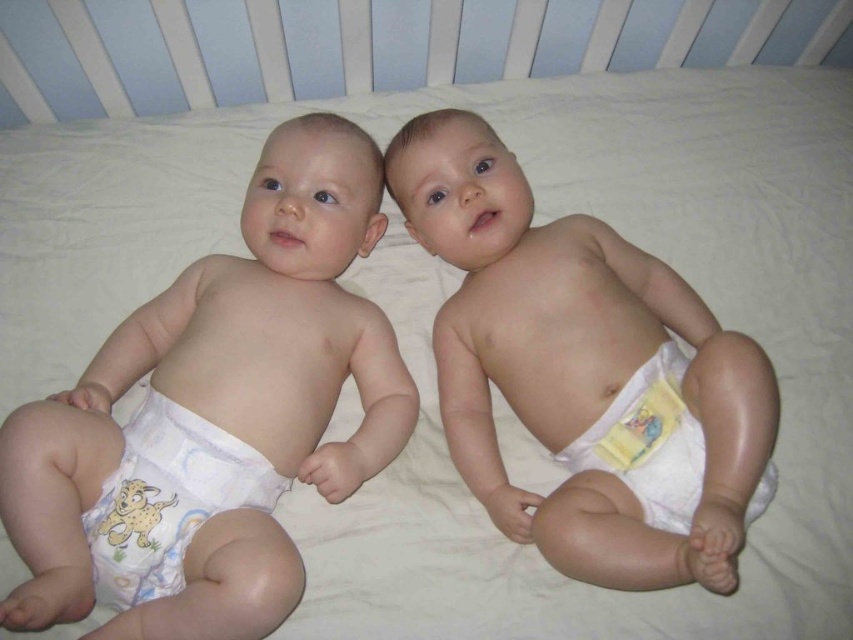
Question: Which of the following is the closest to the observer?

Choices:
 (A) (372, 321)
 (B) (194, 460)
 (C) (630, 460)

Answer: (B)

Question: Is white cloth diaper at left in front of white soft diaper at lower right?

Choices:
 (A) yes
 (B) no

Answer: (A)

Question: Which of the following is the closest to the observer?

Choices:
 (A) white cloth diaper at left
 (B) white soft diaper at lower right
 (C) white cloth diaper at center

Answer: (A)

Question: Is white cloth diaper at center positioned before white cloth diaper at left?

Choices:
 (A) no
 (B) yes

Answer: (A)

Question: Which point appears closest to the camera in this image?

Choices:
 (A) coord(654,472)
 (B) coord(488,394)

Answer: (A)

Question: Is white cloth diaper at center positioned before white soft diaper at lower right?

Choices:
 (A) yes
 (B) no

Answer: (A)